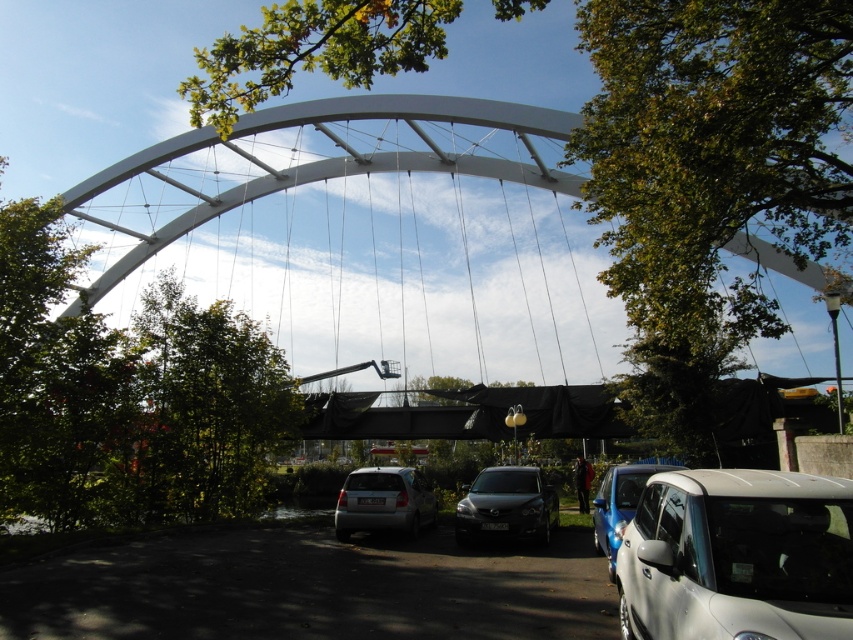
Question: Which point is farther from the camera taking this photo?

Choices:
 (A) (212, 472)
 (B) (541, 477)

Answer: (A)

Question: Which point appears closest to the camera in this image?

Choices:
 (A) (28, 340)
 (B) (648, 337)

Answer: (A)

Question: Can you confirm if dark gray metallic car at center is smaller than silver metallic van at center?

Choices:
 (A) no
 (B) yes

Answer: (B)

Question: Among these points, which one is nearest to the camera?

Choices:
 (A) (828, 611)
 (B) (602, 502)

Answer: (A)

Question: Can you confirm if green leafy tree at center is positioned below satin blue car at lower right?

Choices:
 (A) no
 (B) yes

Answer: (A)

Question: Is green leafy tree at left above satin silver car at lower right?

Choices:
 (A) no
 (B) yes

Answer: (B)